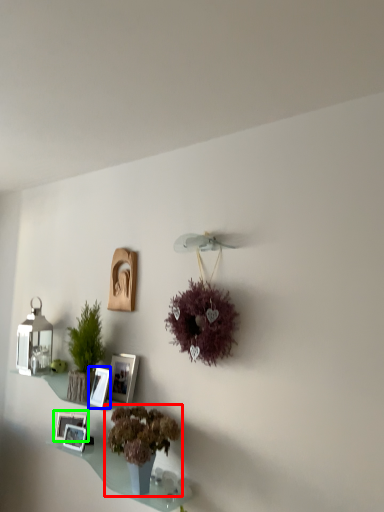
Question: Considering the real-world distances, which object is closest to houseplant (highlighted by a red box)? picture frame (highlighted by a blue box) or picture frame (highlighted by a green box).

Choices:
 (A) picture frame
 (B) picture frame

Answer: (A)